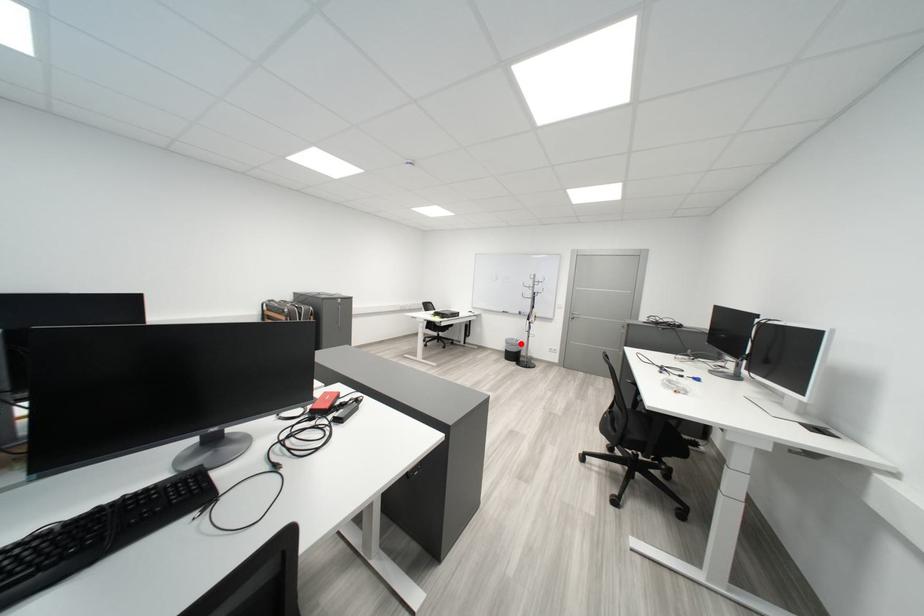
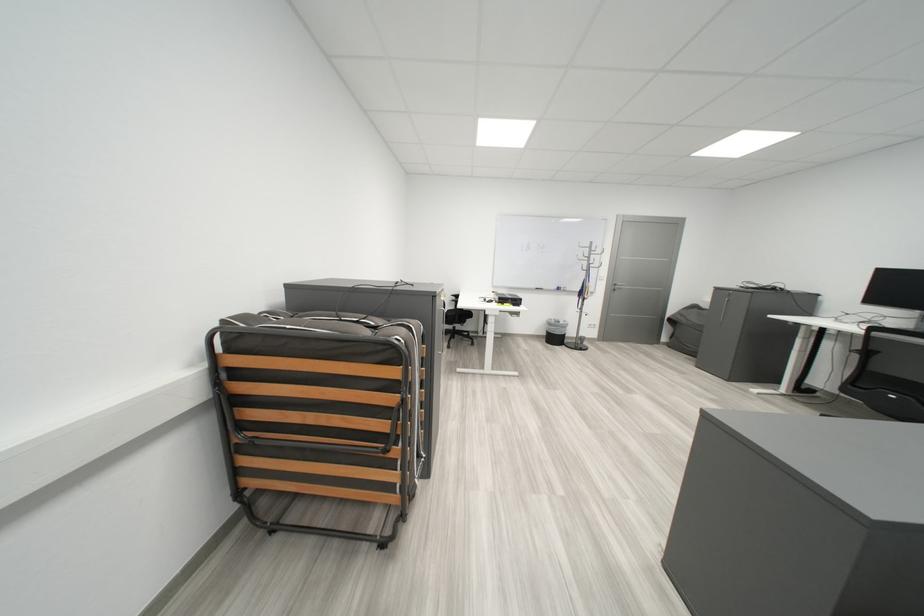
Find the pixel in the second image that matches the highlighted location in the first image.

(563, 326)